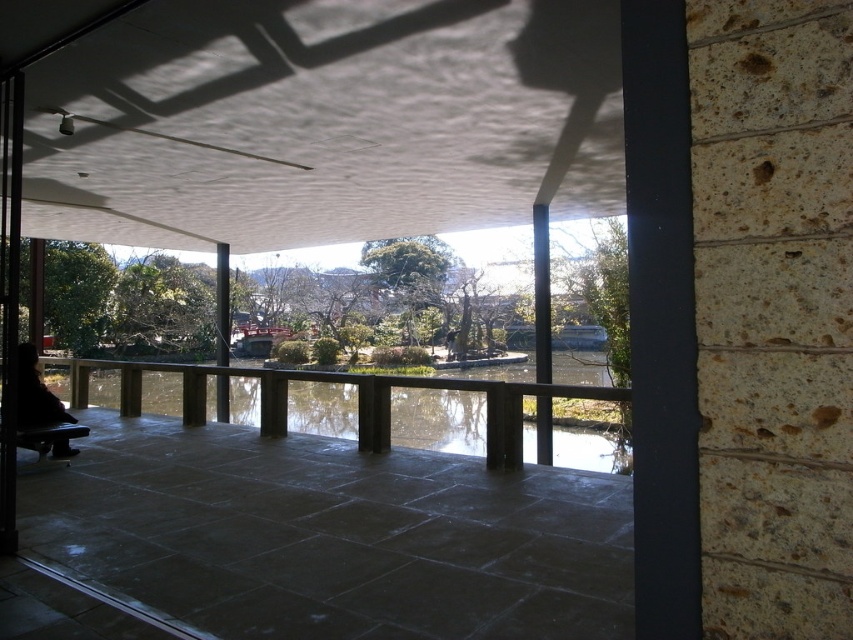
Between point (163, 214) and point (428, 428), which one is positioned in front?

Point (163, 214) is more forward.

Consider the image. Is white textured ceiling at upper center above transparent glass water at center?

Yes, white textured ceiling at upper center is above transparent glass water at center.

Between point (396, 164) and point (254, 419), which one is positioned in front?

Positioned in front is point (396, 164).

Find the location of a particular element. white textured ceiling at upper center is located at coordinates (323, 120).